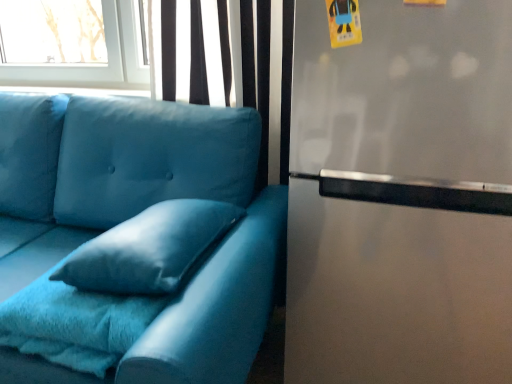
Question: Is matte blue fabric couch at left bigger or smaller than stainless steel fridge at right?

Choices:
 (A) big
 (B) small

Answer: (A)

Question: From the image's perspective, is matte blue fabric couch at left above or below stainless steel fridge at right?

Choices:
 (A) below
 (B) above

Answer: (A)

Question: Considering the real-world distances, which object is farthest from the velvet blue pillow at center?

Choices:
 (A) fuzzy blue blanket at lower left
 (B) stainless steel fridge at right
 (C) matte blue fabric couch at left

Answer: (B)

Question: Based on their relative distances, which object is nearer to the velvet blue pillow at center?

Choices:
 (A) fuzzy blue blanket at lower left
 (B) stainless steel fridge at right
 (C) matte blue fabric couch at left

Answer: (A)